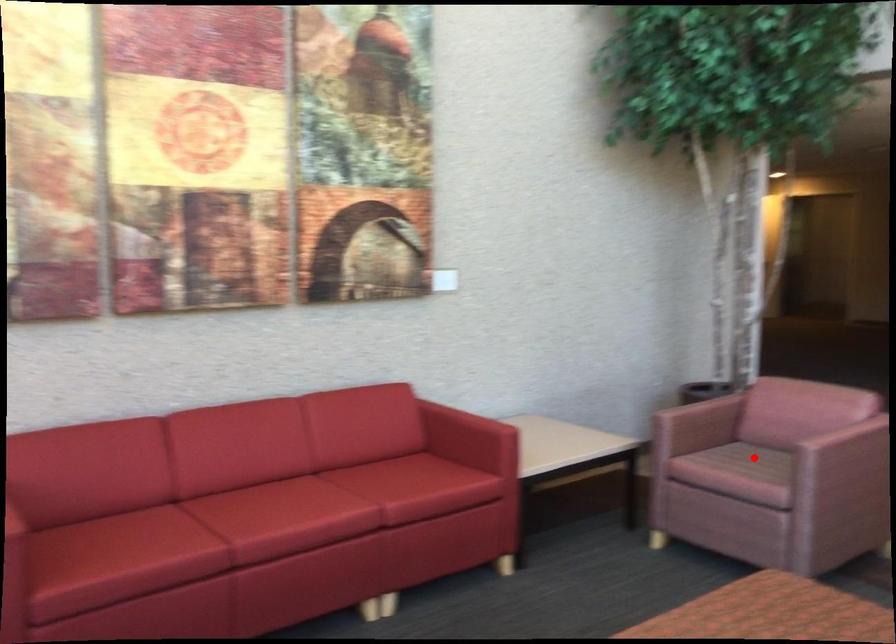
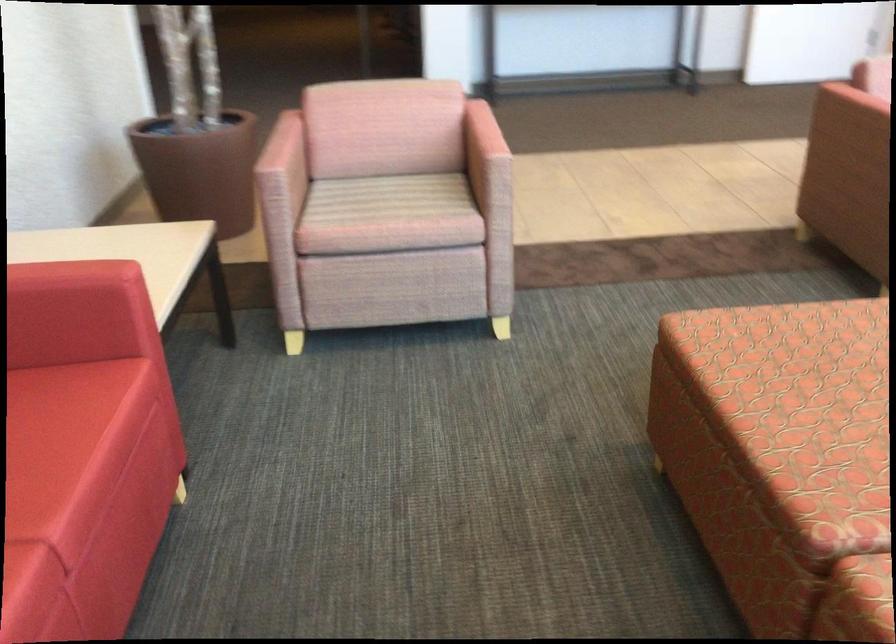
Question: A red point is marked in image1. In image2, is the corresponding 3D point closer to the camera or farther? Reply with the corresponding letter.

Choices:
 (A) The corresponding 3D point is closer.
 (B) The corresponding 3D point is farther.

Answer: (A)